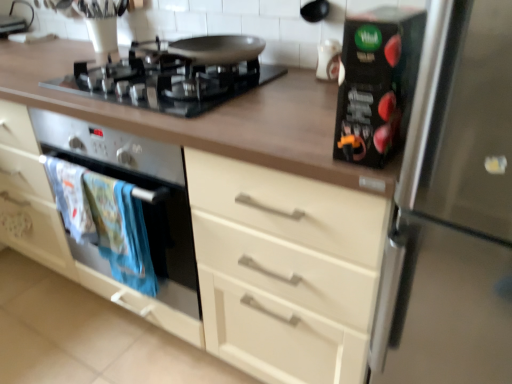
Locate an element on the screen. The image size is (512, 384). free area behind black glossy box at upper right, arranged as the first appliance when viewed from the front is located at coordinates (311, 114).